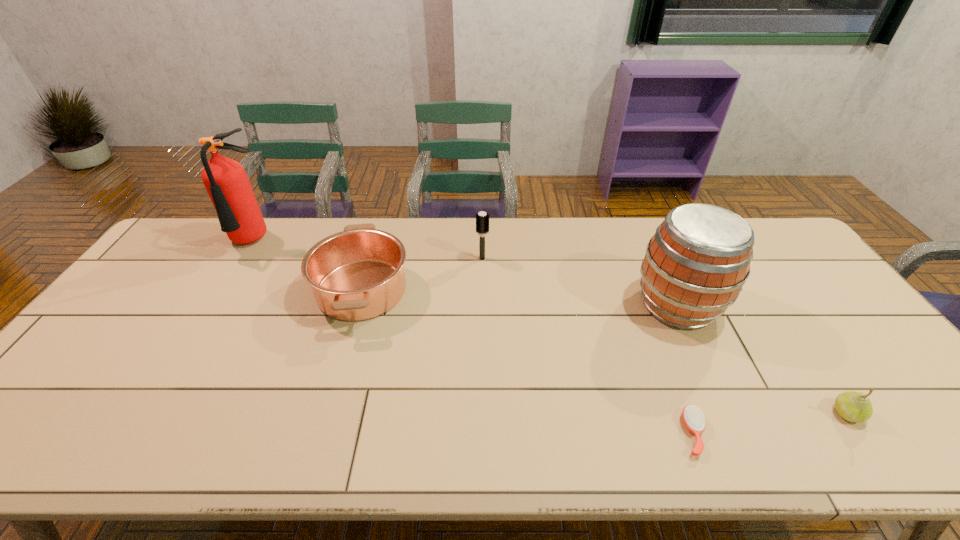
Identify the location of vacant space that satisfies the following two spatial constraints: 1. at the nozzle of the leftmost object; 2. on the right side of the pear. The width and height of the screenshot is (960, 540). (147, 413).

Identify the location of vacant space that satisfies the following two spatial constraints: 1. at the nozzle of the pear; 2. on the left side of the fire extinguisher. The width and height of the screenshot is (960, 540). (147, 413).

Identify the location of free space that satisfies the following two spatial constraints: 1. at the nozzle of the fire extinguisher; 2. on the left side of the pear. The image size is (960, 540). (147, 413).

The image size is (960, 540). I want to click on free space that satisfies the following two spatial constraints: 1. at the nozzle of the second object from left to right; 2. on the right side of the leftmost object, so click(225, 289).